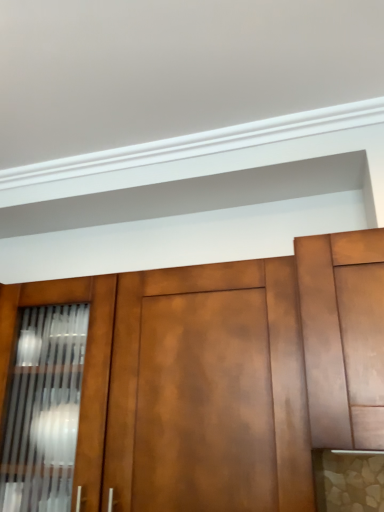
You are a GUI agent. You are given a task and a screenshot of the screen. Output one action in this format:
    pyautogui.click(x=<x>, y=<y>)
    Task: Click on the matte brown cabinet at right, marked as the first cabinetry in a right-to-left arrangement
    The width and height of the screenshot is (384, 512).
    Given the screenshot: What is the action you would take?
    pyautogui.click(x=322, y=344)

How much space does matte brown cabinet at right, arranged as the 2th cabinetry when viewed from the left, occupy vertically?

matte brown cabinet at right, arranged as the 2th cabinetry when viewed from the left, is 39.43 centimeters tall.

What do you see at coordinates (322, 344) in the screenshot? This screenshot has width=384, height=512. I see `matte brown cabinet at right, arranged as the 2th cabinetry when viewed from the left` at bounding box center [322, 344].

In order to face matte wood cabinet at center, which is counted as the first cabinetry, starting from the left, should I rotate leftwards or rightwards?

To align with it, rotate left about 6.084°.

Looking at this image, measure the distance between matte wood cabinet at center, which is counted as the first cabinetry, starting from the left, and camera.

matte wood cabinet at center, which is counted as the first cabinetry, starting from the left, and camera are 70.27 centimeters apart from each other.

This screenshot has width=384, height=512. I want to click on matte wood cabinet at center, which ranks as the second cabinetry in right-to-left order, so click(222, 372).

Describe the element at coordinates (222, 372) in the screenshot. Image resolution: width=384 pixels, height=512 pixels. I see `matte wood cabinet at center, which ranks as the second cabinetry in right-to-left order` at that location.

At what (x,y) coordinates should I click in order to perform the action: click on matte brown cabinet at right, marked as the first cabinetry in a right-to-left arrangement. Please return your answer as a coordinate pair (x, y). Image resolution: width=384 pixels, height=512 pixels. Looking at the image, I should click on (322, 344).

Considering the positions of objects matte brown cabinet at right, marked as the first cabinetry in a right-to-left arrangement, and matte wood cabinet at center, which is counted as the first cabinetry, starting from the left, in the image provided, who is more to the right, matte brown cabinet at right, marked as the first cabinetry in a right-to-left arrangement, or matte wood cabinet at center, which is counted as the first cabinetry, starting from the left,?

matte brown cabinet at right, marked as the first cabinetry in a right-to-left arrangement, is more to the right.

Is matte brown cabinet at right, arranged as the 2th cabinetry when viewed from the left, positioned behind matte wood cabinet at center, which ranks as the second cabinetry in right-to-left order?

No, matte brown cabinet at right, arranged as the 2th cabinetry when viewed from the left, is closer to the camera.

Which point is more distant from viewer, (324, 381) or (221, 312)?

Point (221, 312)

From the image's perspective, is matte brown cabinet at right, arranged as the 2th cabinetry when viewed from the left, positioned above or below matte wood cabinet at center, which is counted as the first cabinetry, starting from the left?

From the image's perspective, matte brown cabinet at right, arranged as the 2th cabinetry when viewed from the left, appears above matte wood cabinet at center, which is counted as the first cabinetry, starting from the left.

From a real-world perspective, does matte brown cabinet at right, arranged as the 2th cabinetry when viewed from the left, sit lower than matte wood cabinet at center, which is counted as the first cabinetry, starting from the left?

No, from a real-world perspective, matte brown cabinet at right, arranged as the 2th cabinetry when viewed from the left, is not below matte wood cabinet at center, which is counted as the first cabinetry, starting from the left.

Which of these two, matte brown cabinet at right, marked as the first cabinetry in a right-to-left arrangement, or matte wood cabinet at center, which is counted as the first cabinetry, starting from the left, is thinner?

Thinner between the two is matte wood cabinet at center, which is counted as the first cabinetry, starting from the left.

Considering the sizes of matte brown cabinet at right, marked as the first cabinetry in a right-to-left arrangement, and matte wood cabinet at center, which ranks as the second cabinetry in right-to-left order, in the image, is matte brown cabinet at right, marked as the first cabinetry in a right-to-left arrangement, taller or shorter than matte wood cabinet at center, which ranks as the second cabinetry in right-to-left order,?

Clearly, matte brown cabinet at right, marked as the first cabinetry in a right-to-left arrangement, is shorter compared to matte wood cabinet at center, which ranks as the second cabinetry in right-to-left order.

Does matte brown cabinet at right, marked as the first cabinetry in a right-to-left arrangement, have a larger size compared to matte wood cabinet at center, which ranks as the second cabinetry in right-to-left order?

No, matte brown cabinet at right, marked as the first cabinetry in a right-to-left arrangement, is not bigger than matte wood cabinet at center, which ranks as the second cabinetry in right-to-left order.

Would you say matte wood cabinet at center, which ranks as the second cabinetry in right-to-left order, is part of matte brown cabinet at right, marked as the first cabinetry in a right-to-left arrangement,'s contents?

That's incorrect, matte wood cabinet at center, which ranks as the second cabinetry in right-to-left order, is not inside matte brown cabinet at right, marked as the first cabinetry in a right-to-left arrangement.

Is there a large distance between matte brown cabinet at right, arranged as the 2th cabinetry when viewed from the left, and matte wood cabinet at center, which is counted as the first cabinetry, starting from the left?

No, matte brown cabinet at right, arranged as the 2th cabinetry when viewed from the left, is not far from matte wood cabinet at center, which is counted as the first cabinetry, starting from the left.

Is matte brown cabinet at right, arranged as the 2th cabinetry when viewed from the left, looking in the opposite direction of matte wood cabinet at center, which ranks as the second cabinetry in right-to-left order?

No, matte wood cabinet at center, which ranks as the second cabinetry in right-to-left order, is not at the back of matte brown cabinet at right, arranged as the 2th cabinetry when viewed from the left.

Looking at this image, can you tell me how much matte brown cabinet at right, arranged as the 2th cabinetry when viewed from the left, and matte wood cabinet at center, which ranks as the second cabinetry in right-to-left order, differ in facing direction?

0.355 degrees separate the facing orientations of matte brown cabinet at right, arranged as the 2th cabinetry when viewed from the left, and matte wood cabinet at center, which ranks as the second cabinetry in right-to-left order.

Measure the distance between matte brown cabinet at right, marked as the first cabinetry in a right-to-left arrangement, and matte wood cabinet at center, which ranks as the second cabinetry in right-to-left order.

8.53 inches.

The height and width of the screenshot is (512, 384). I want to click on cabinetry on the left side of matte brown cabinet at right, arranged as the 2th cabinetry when viewed from the left, so click(x=222, y=372).

Which object is positioned more to the left, matte wood cabinet at center, which ranks as the second cabinetry in right-to-left order, or matte brown cabinet at right, arranged as the 2th cabinetry when viewed from the left?

Positioned to the left is matte wood cabinet at center, which ranks as the second cabinetry in right-to-left order.

Which object is closer to the camera, matte wood cabinet at center, which is counted as the first cabinetry, starting from the left, or matte brown cabinet at right, marked as the first cabinetry in a right-to-left arrangement?

matte brown cabinet at right, marked as the first cabinetry in a right-to-left arrangement, is closer to the camera.

Considering the points (159, 499) and (327, 272), which point is in front, point (159, 499) or point (327, 272)?

Point (327, 272)

From the image's perspective, would you say matte wood cabinet at center, which ranks as the second cabinetry in right-to-left order, is shown under matte brown cabinet at right, marked as the first cabinetry in a right-to-left arrangement?

Correct, matte wood cabinet at center, which ranks as the second cabinetry in right-to-left order, appears lower than matte brown cabinet at right, marked as the first cabinetry in a right-to-left arrangement, in the image.

From a real-world perspective, between matte wood cabinet at center, which ranks as the second cabinetry in right-to-left order, and matte brown cabinet at right, marked as the first cabinetry in a right-to-left arrangement, who is vertically higher?

matte brown cabinet at right, marked as the first cabinetry in a right-to-left arrangement, from a real-world perspective.

Which of these two, matte wood cabinet at center, which ranks as the second cabinetry in right-to-left order, or matte brown cabinet at right, arranged as the 2th cabinetry when viewed from the left, is wider?

Wider between the two is matte brown cabinet at right, arranged as the 2th cabinetry when viewed from the left.

Between matte wood cabinet at center, which ranks as the second cabinetry in right-to-left order, and matte brown cabinet at right, arranged as the 2th cabinetry when viewed from the left, which one has more height?

matte wood cabinet at center, which ranks as the second cabinetry in right-to-left order, is taller.

Considering the sizes of objects matte wood cabinet at center, which ranks as the second cabinetry in right-to-left order, and matte brown cabinet at right, marked as the first cabinetry in a right-to-left arrangement, in the image provided, who is bigger, matte wood cabinet at center, which ranks as the second cabinetry in right-to-left order, or matte brown cabinet at right, marked as the first cabinetry in a right-to-left arrangement,?

matte wood cabinet at center, which ranks as the second cabinetry in right-to-left order, is bigger.

Can we say matte wood cabinet at center, which ranks as the second cabinetry in right-to-left order, lies outside matte brown cabinet at right, marked as the first cabinetry in a right-to-left arrangement?

Absolutely, matte wood cabinet at center, which ranks as the second cabinetry in right-to-left order, is external to matte brown cabinet at right, marked as the first cabinetry in a right-to-left arrangement.

From the picture: Is matte wood cabinet at center, which is counted as the first cabinetry, starting from the left, in contact with matte brown cabinet at right, arranged as the 2th cabinetry when viewed from the left?

No, matte wood cabinet at center, which is counted as the first cabinetry, starting from the left, is not touching matte brown cabinet at right, arranged as the 2th cabinetry when viewed from the left.

Is matte brown cabinet at right, arranged as the 2th cabinetry when viewed from the left, at the back of matte wood cabinet at center, which ranks as the second cabinetry in right-to-left order?

matte wood cabinet at center, which ranks as the second cabinetry in right-to-left order, is not turned away from matte brown cabinet at right, arranged as the 2th cabinetry when viewed from the left.

What's the angular difference between matte wood cabinet at center, which is counted as the first cabinetry, starting from the left, and matte brown cabinet at right, arranged as the 2th cabinetry when viewed from the left,'s facing directions?

0.355 degrees.

How far apart are matte wood cabinet at center, which ranks as the second cabinetry in right-to-left order, and matte brown cabinet at right, arranged as the 2th cabinetry when viewed from the left?

The distance of matte wood cabinet at center, which ranks as the second cabinetry in right-to-left order, from matte brown cabinet at right, arranged as the 2th cabinetry when viewed from the left, is 8.53 inches.

Where is `cabinetry on the left of the matte brown cabinet at right, marked as the first cabinetry in a right-to-left arrangement`? The width and height of the screenshot is (384, 512). cabinetry on the left of the matte brown cabinet at right, marked as the first cabinetry in a right-to-left arrangement is located at coordinates (222, 372).

Where is `cabinetry in front of the matte wood cabinet at center, which is counted as the first cabinetry, starting from the left`? This screenshot has width=384, height=512. cabinetry in front of the matte wood cabinet at center, which is counted as the first cabinetry, starting from the left is located at coordinates (322, 344).

Image resolution: width=384 pixels, height=512 pixels. In order to click on cabinetry on the right of matte wood cabinet at center, which ranks as the second cabinetry in right-to-left order in this screenshot , I will do `click(322, 344)`.